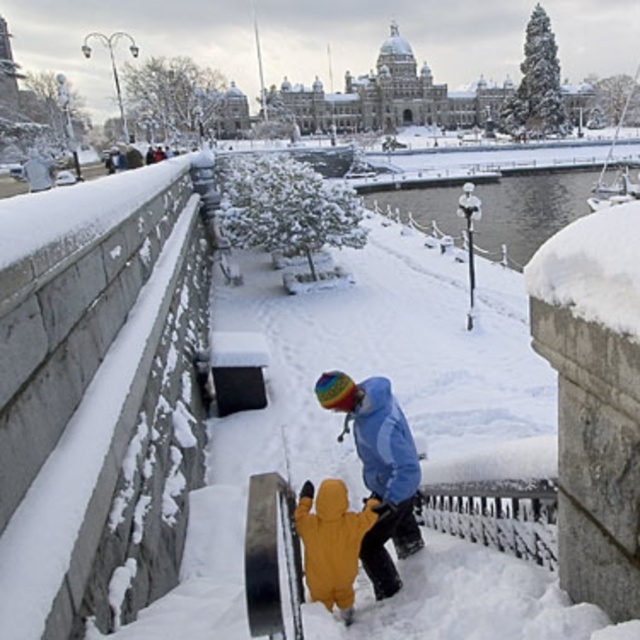
You are standing at the bottom of the snow covered stairs in the winter scene. You see two points marked on the steps. The first point is at coordinate point (310, 598) and the second point is at coordinate point (390, 454). Which point is closer to you as you start climbing the stairs?

Point (310, 598) is in front of point (390, 454), so the first point is closer to you as you start climbing the stairs.